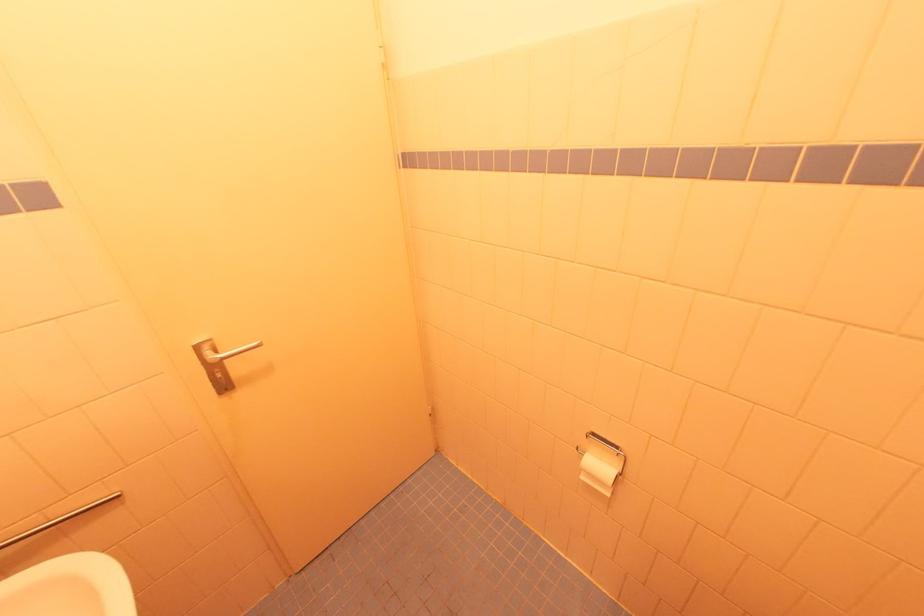
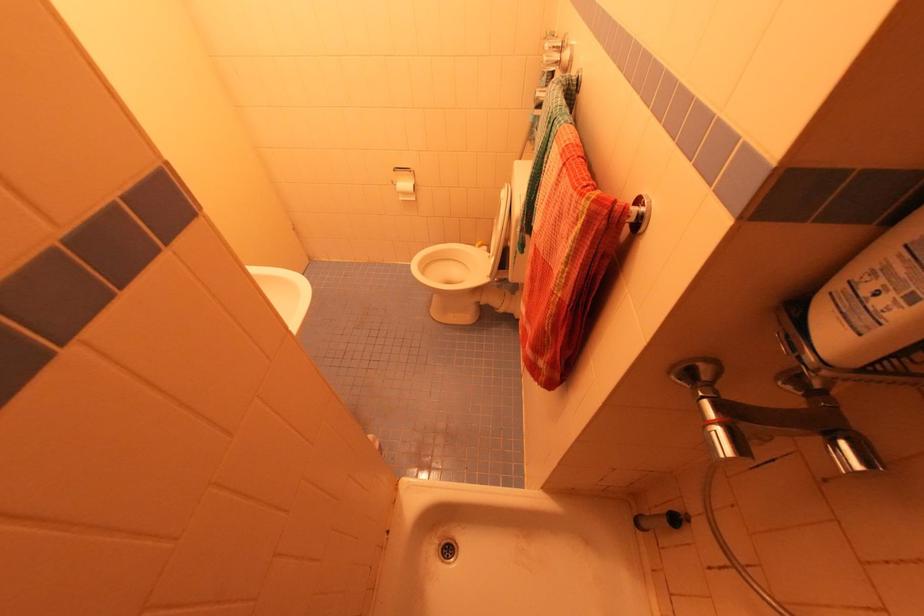
Find the pixel in the second image that matches pixel 585 479 in the first image.

(403, 200)